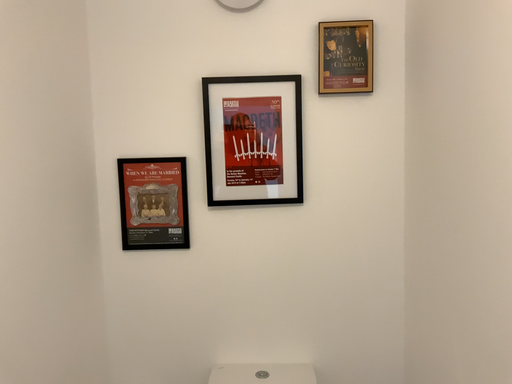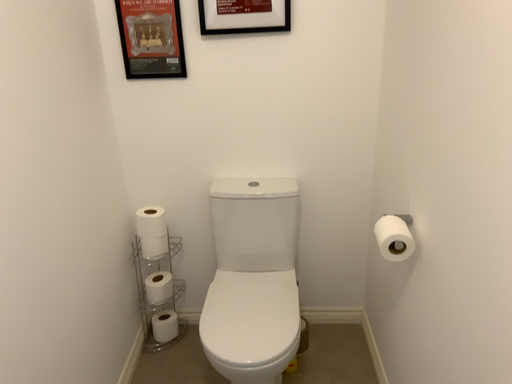
Question: How did the camera likely rotate when shooting the video?

Choices:
 (A) rotated upward
 (B) rotated downward

Answer: (B)